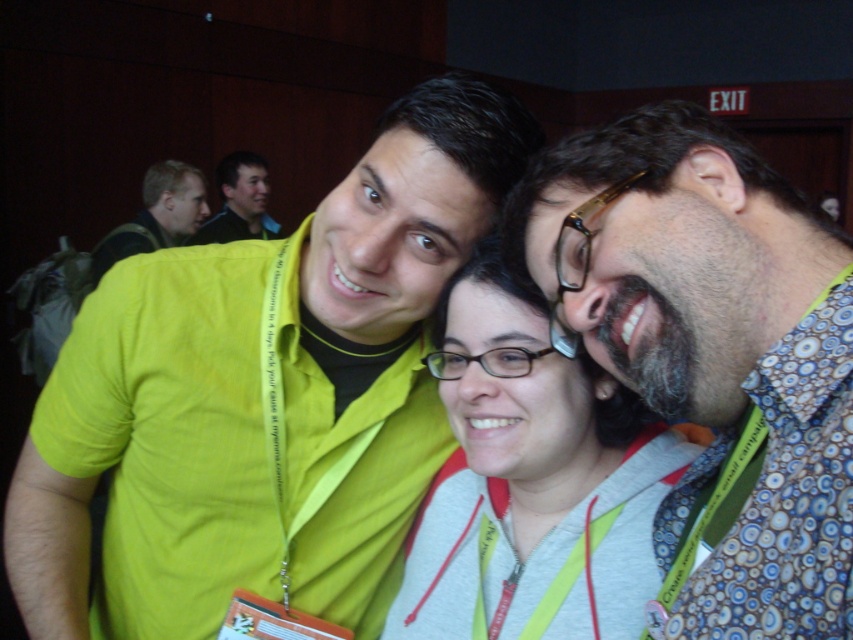
You are a photographer adjusting the focus on your camera. You notice two points in the image at coordinates point [492,237] and point [172,237]. Which point should you focus on first to ensure the subject closest to the camera is sharp?

Point [492,237] is closer to the camera than point [172,237], so you should focus on point [492,237] first to ensure the subject closest to the camera is sharp.

You are standing in front of the group of three people in the photo. There are two points marked on the image at coordinates point (x=520, y=204) and point (x=172, y=179). Which point is closer to you?

Point (x=520, y=204) is closer to the viewer than point (x=172, y=179).